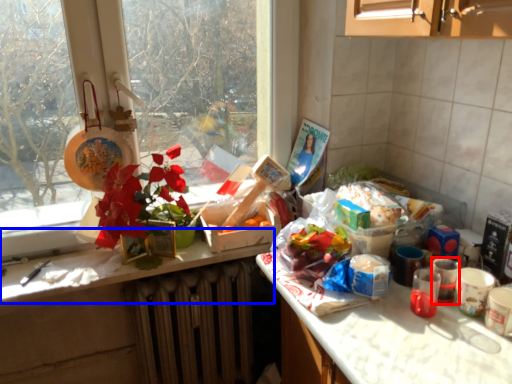
Question: Among these objects, which one is farthest to the camera, coffee cup (highlighted by a red box) or counter top (highlighted by a blue box)?

Choices:
 (A) coffee cup
 (B) counter top

Answer: (B)